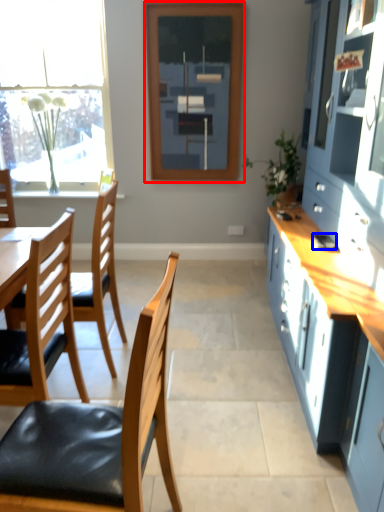
Question: Which object is further to the camera taking this photo, window frame (highlighted by a red box) or mobile phone (highlighted by a blue box)?

Choices:
 (A) window frame
 (B) mobile phone

Answer: (A)